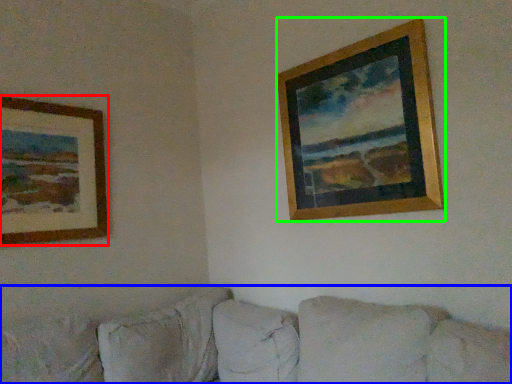
Question: Which is farther away from picture frame (highlighted by a red box)? studio couch (highlighted by a blue box) or picture frame (highlighted by a green box)?

Choices:
 (A) studio couch
 (B) picture frame

Answer: (B)